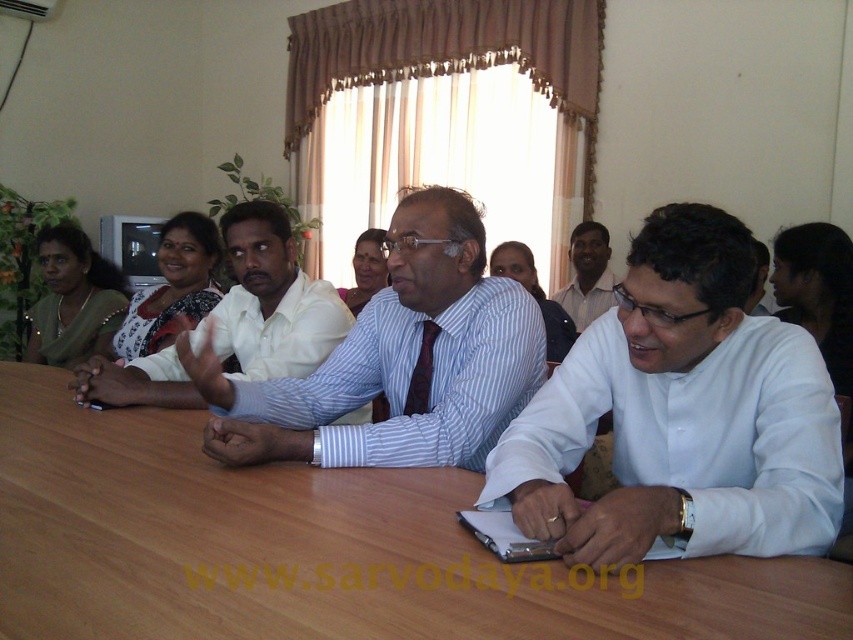
Is brown wooden table at center positioned behind blue striped shirt at center?

That is False.

This screenshot has height=640, width=853. What do you see at coordinates (317, 548) in the screenshot?
I see `brown wooden table at center` at bounding box center [317, 548].

Between point (463, 502) and point (541, 381), which one is positioned in front?

Point (463, 502) is more forward.

Locate an element on the screen. This screenshot has height=640, width=853. brown wooden table at center is located at coordinates (317, 548).

Which is below, brown wooden table at center or white shirt at center?

brown wooden table at center is lower down.

From the picture: Does brown wooden table at center have a smaller size compared to white shirt at center?

No, brown wooden table at center is not smaller than white shirt at center.

In order to click on brown wooden table at center in this screenshot , I will do `click(317, 548)`.

Is point (676, 355) farther from camera compared to point (258, 346)?

No, it is in front of (258, 346).

Does white matte shirt at center have a greater height compared to striped cotton shirt at center?

No, white matte shirt at center is not taller than striped cotton shirt at center.

Who is more forward, (660, 481) or (247, 316)?

Point (660, 481)

In order to click on white matte shirt at center in this screenshot , I will do `click(680, 416)`.